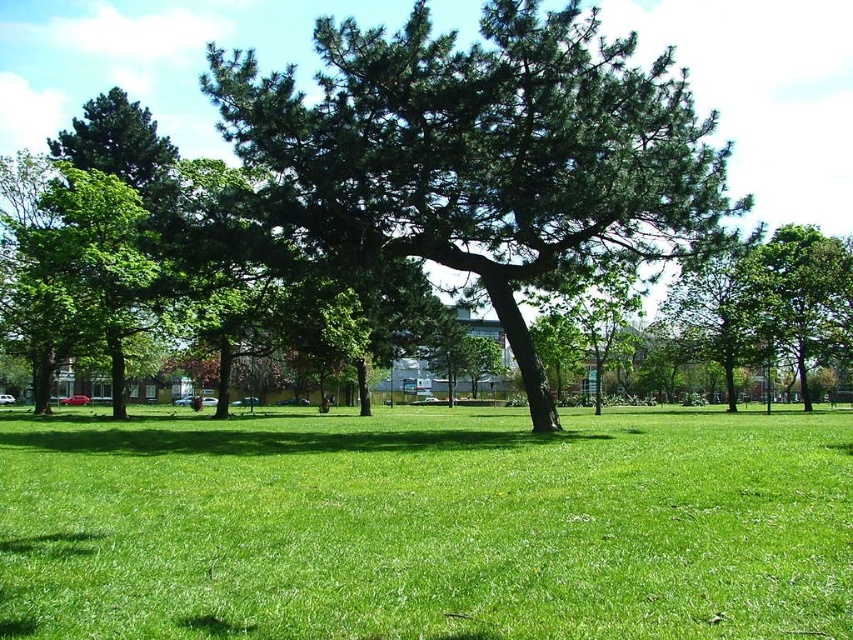
Question: Does green grassy field at center have a larger size compared to green leafy tree at center?

Choices:
 (A) yes
 (B) no

Answer: (B)

Question: Observing the image, what is the correct spatial positioning of green grassy field at center in reference to green leafy tree at center?

Choices:
 (A) left
 (B) right

Answer: (A)

Question: Which of the following is the closest to the observer?

Choices:
 (A) (408, 35)
 (B) (780, 476)

Answer: (B)

Question: Does green grassy field at center have a greater width compared to green leafy tree at center?

Choices:
 (A) no
 (B) yes

Answer: (B)